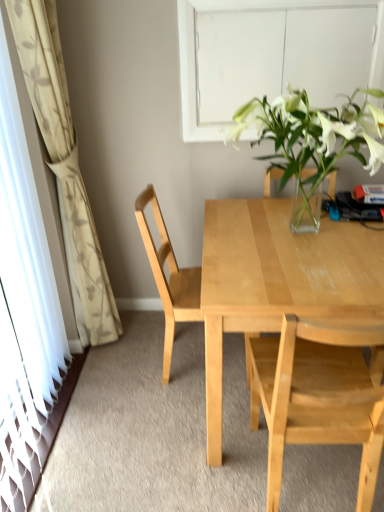
Where is `vacant space to the left of light wood chair at center, which is counted as the second chair, starting from the back`? vacant space to the left of light wood chair at center, which is counted as the second chair, starting from the back is located at coordinates (188, 462).